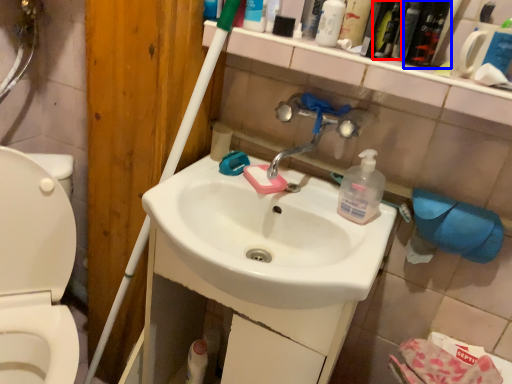
Question: Which point is closer to the camera, mouthwash (highlighted by a red box) or mouthwash (highlighted by a blue box)?

Choices:
 (A) mouthwash
 (B) mouthwash

Answer: (B)